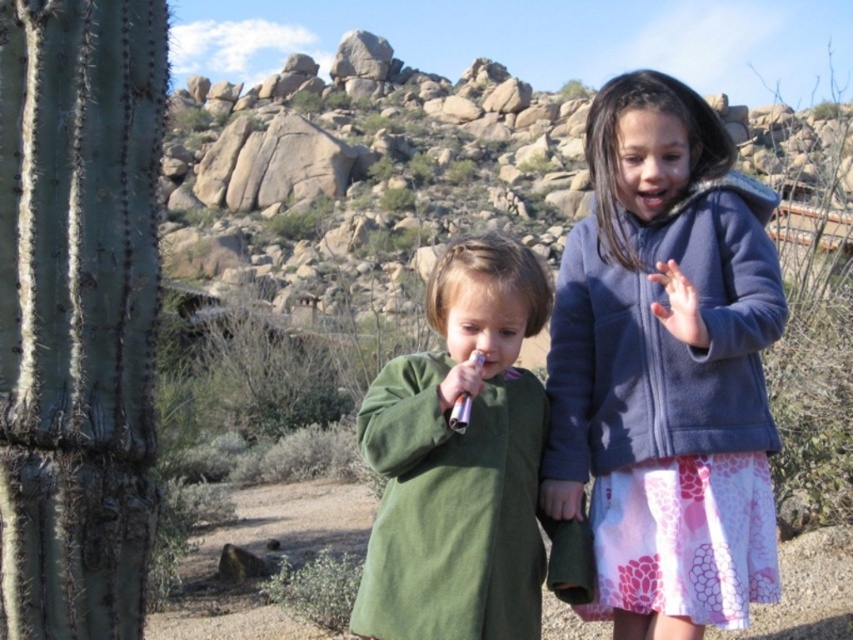
Looking at this image, does blue fleece jacket at center appear over green fleece jacket at center?

Correct, blue fleece jacket at center is located above green fleece jacket at center.

Who is more distant from viewer, (x=762, y=202) or (x=379, y=513)?

The point (x=762, y=202) is more distant.

The height and width of the screenshot is (640, 853). Describe the element at coordinates (666, 365) in the screenshot. I see `blue fleece jacket at center` at that location.

Where is `blue fleece jacket at center`? The image size is (853, 640). blue fleece jacket at center is located at coordinates (666, 365).